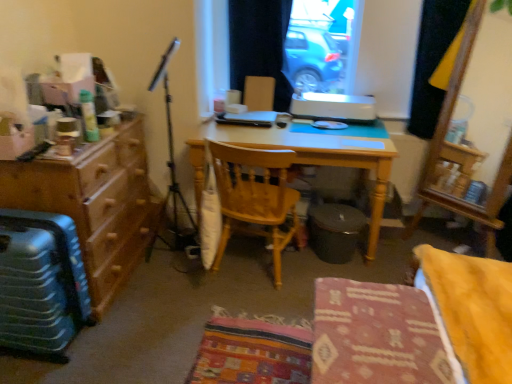
Identify the location of vacant space in front of wooden chair at center, marked as the 2th chair in a front-to-back arrangement. (246, 318).